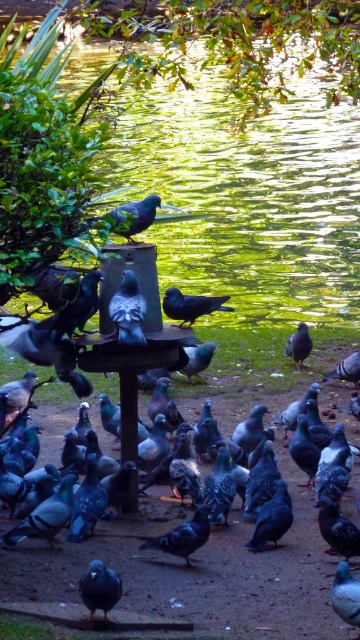
Is shiny black bird at center bigger than shiny gray pigeon at center?

Correct, shiny black bird at center is larger in size than shiny gray pigeon at center.

Does shiny black bird at center appear over shiny gray pigeon at center?

Yes.

Where is `shiny black bird at center`? Image resolution: width=360 pixels, height=640 pixels. shiny black bird at center is located at coordinates (191, 305).

What do you see at coordinates (128, 310) in the screenshot? The height and width of the screenshot is (640, 360). I see `shiny metallic bird at center` at bounding box center [128, 310].

Which is below, shiny metallic bird at center or shiny blue bird at center?

shiny metallic bird at center

Is point (133, 289) behind point (55, 326)?

That is False.

Where is `shiny metallic bird at center`? shiny metallic bird at center is located at coordinates (128, 310).

Which is above, matte gray pigeon at center or shiny blue bird at center?

Positioned higher is shiny blue bird at center.

Who is positioned more to the left, matte gray pigeon at center or shiny blue bird at center?

From the viewer's perspective, shiny blue bird at center appears more on the left side.

Which is behind, point (195, 545) or point (84, 280)?

Positioned behind is point (84, 280).

Identify the location of matte gray pigeon at center. This screenshot has height=640, width=360. (183, 536).